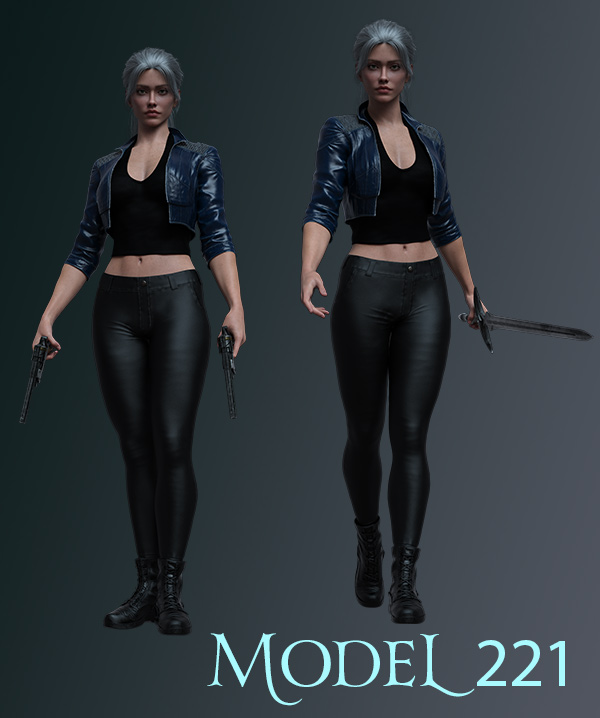
Locate an element on the screen. handle is located at coordinates (454, 299), (210, 330), (51, 355).